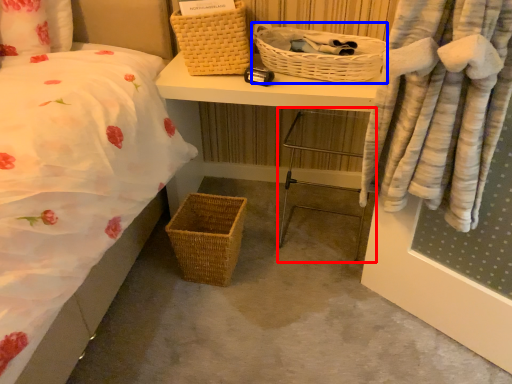
Question: Among these objects, which one is farthest to the camera, chair (highlighted by a red box) or picnic basket (highlighted by a blue box)?

Choices:
 (A) chair
 (B) picnic basket

Answer: (A)